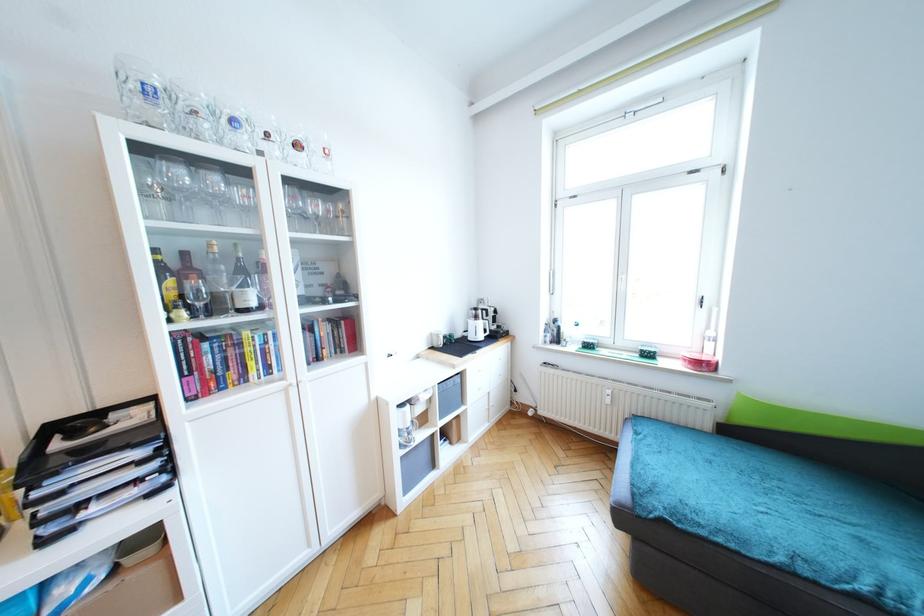
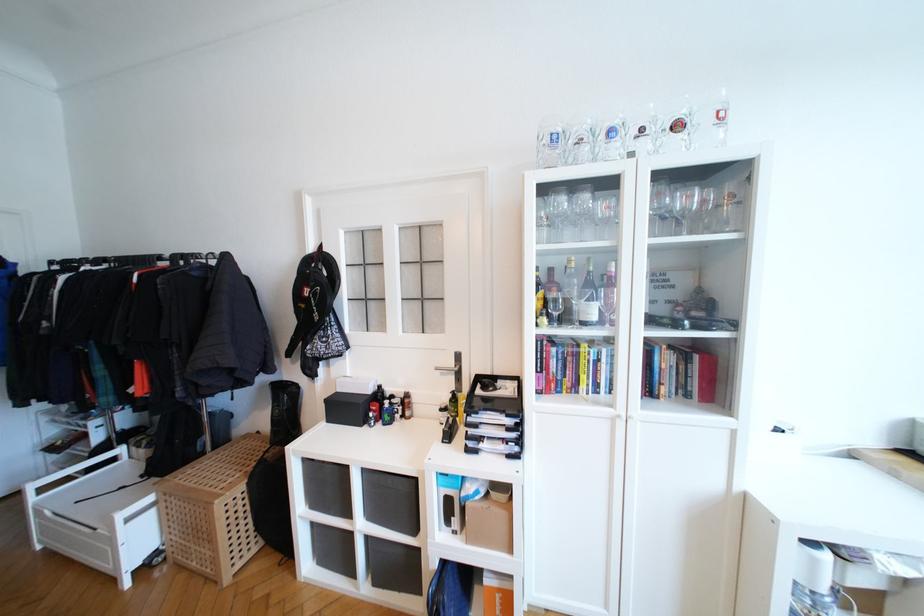
The point at (202, 306) is marked in the first image. Where is the corresponding point in the second image?

(558, 315)